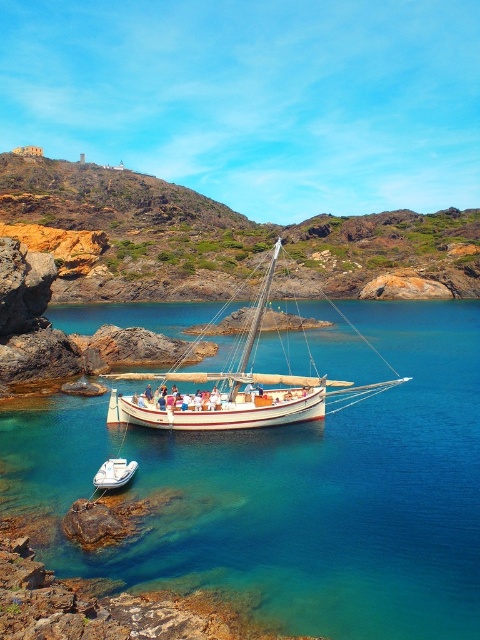
You are a photographer planning to capture the clear blue water at center and the rustic stone cliff at upper left in a single shot. Based on their heights, which object will appear closer to the bottom of the photo?

The clear blue water at center will appear closer to the bottom of the photo because it is shorter than the rustic stone cliff at upper left.

You are standing on the rocky shore and want to board either the white wooden sailboat at center or the white matte dinghy at lower left. Which vessel will you reach first if you walk straight ahead?

The white wooden sailboat at center is closer to you, so you will reach it first before the white matte dinghy at lower left.